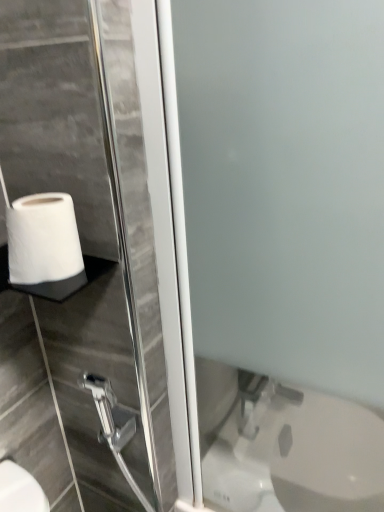
Question: From a real-world perspective, is white matte toilet paper at lower left physically located above or below frosted glass screen door at center?

Choices:
 (A) below
 (B) above

Answer: (B)

Question: Is point (72, 225) closer or farther from the camera than point (347, 349)?

Choices:
 (A) farther
 (B) closer

Answer: (B)

Question: Based on their relative distances, which object is farther from the frosted glass screen door at center?

Choices:
 (A) white matte toilet paper at lower left
 (B) metallic silver shower head at lower left

Answer: (B)

Question: Based on their relative distances, which object is farther from the white matte toilet paper at lower left?

Choices:
 (A) frosted glass screen door at center
 (B) metallic silver shower head at lower left

Answer: (B)